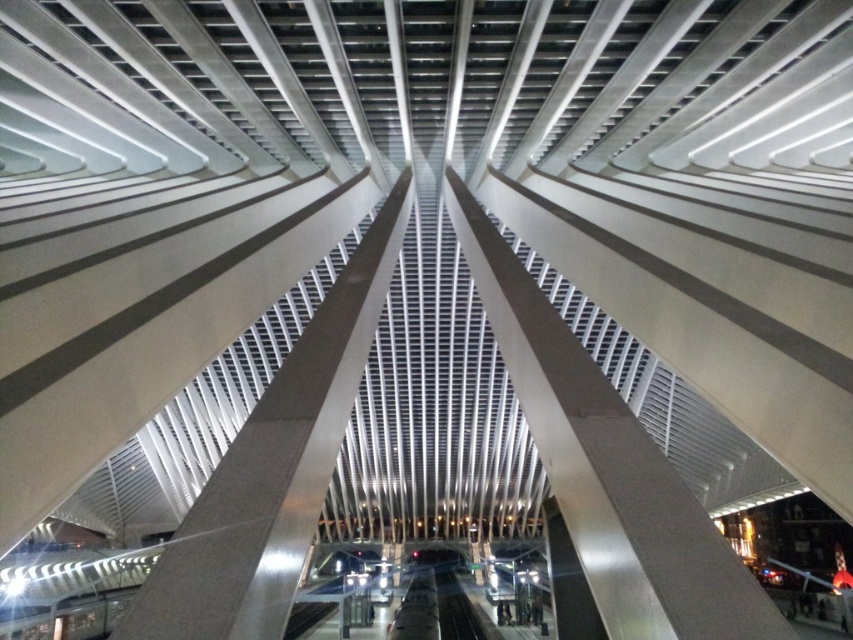
Is metallic silver beam at center taller than satin silver beam at center?

Yes.

Between metallic silver beam at center and satin silver beam at center, which one is positioned higher?

satin silver beam at center

Between point (596, 513) and point (358, 326), which one is positioned in front?

Point (596, 513)

You are a GUI agent. You are given a task and a screenshot of the screen. Output one action in this format:
    pyautogui.click(x=<x>, y=<y>)
    Task: Click on the metallic silver beam at center
    The image size is (853, 640).
    Given the screenshot: What is the action you would take?
    pyautogui.click(x=607, y=467)